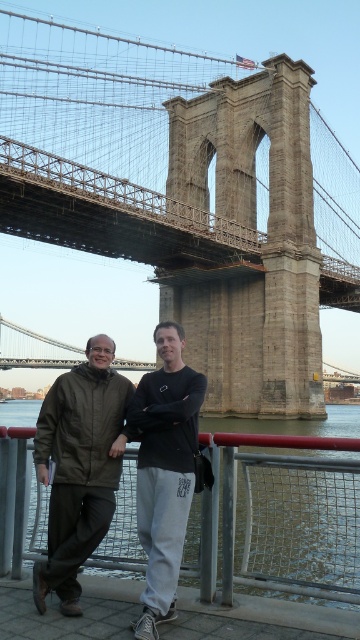
Question: Is stone stone suspension bridge at center below black cotton sweatshirt at center?

Choices:
 (A) yes
 (B) no

Answer: (B)

Question: Is matte olive-green jacket at center behind black cotton sweatshirt at center?

Choices:
 (A) yes
 (B) no

Answer: (A)

Question: Considering the real-world distances, which object is closest to the matte olive-green jacket at center?

Choices:
 (A) stone stone suspension bridge at center
 (B) black cotton sweatshirt at center

Answer: (B)

Question: Which point is farther to the camera?

Choices:
 (A) metal/rusty rail at lower center
 (B) stone stone suspension bridge at center
 (C) black cotton sweatshirt at center

Answer: (B)

Question: Which object is farther from the camera taking this photo?

Choices:
 (A) black cotton sweatshirt at center
 (B) stone stone suspension bridge at center
 (C) matte olive-green jacket at center
 (D) metal/rusty rail at lower center

Answer: (B)

Question: Does metal/rusty rail at lower center have a greater width compared to matte olive-green jacket at center?

Choices:
 (A) no
 (B) yes

Answer: (B)